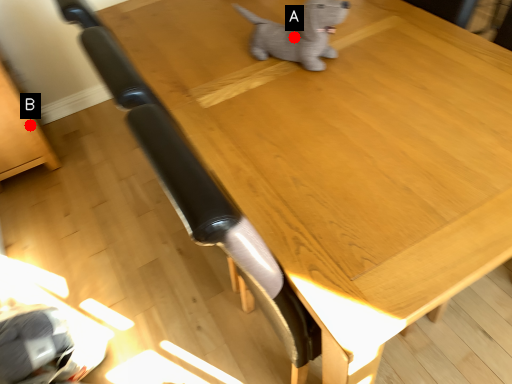
Question: Two points are circled on the image, labeled by A and B beside each circle. Which point is farther to the camera?

Choices:
 (A) A is further
 (B) B is further

Answer: (B)